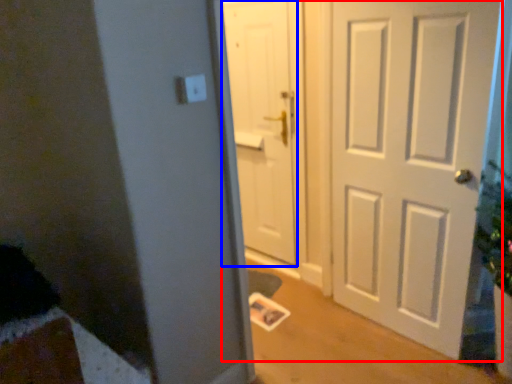
Question: Which point is closer to the camera, door (highlighted by a red box) or door (highlighted by a blue box)?

Choices:
 (A) door
 (B) door

Answer: (A)